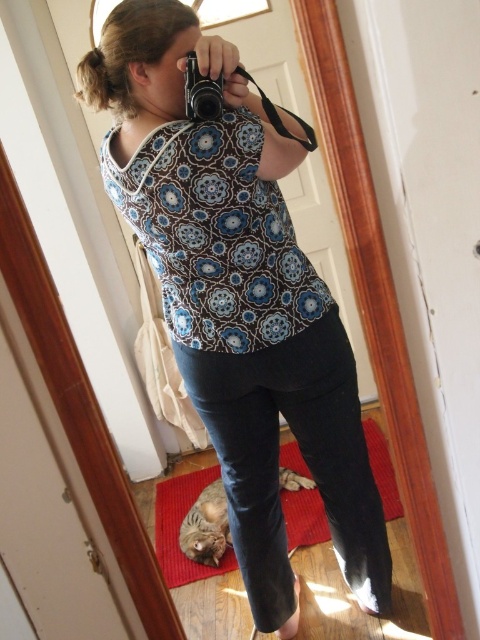
Does patterned fabric blouse at center appear over black plastic camera at upper center?

Actually, patterned fabric blouse at center is below black plastic camera at upper center.

Between patterned fabric blouse at center and black plastic camera at upper center, which one appears on the right side from the viewer's perspective?

Positioned to the right is patterned fabric blouse at center.

The height and width of the screenshot is (640, 480). Find the location of `patterned fabric blouse at center`. patterned fabric blouse at center is located at coordinates (238, 298).